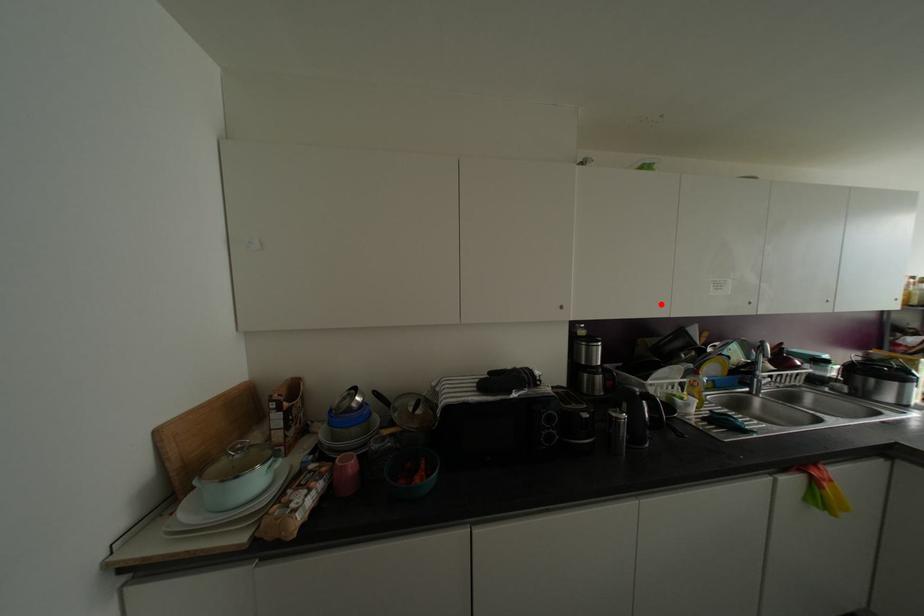
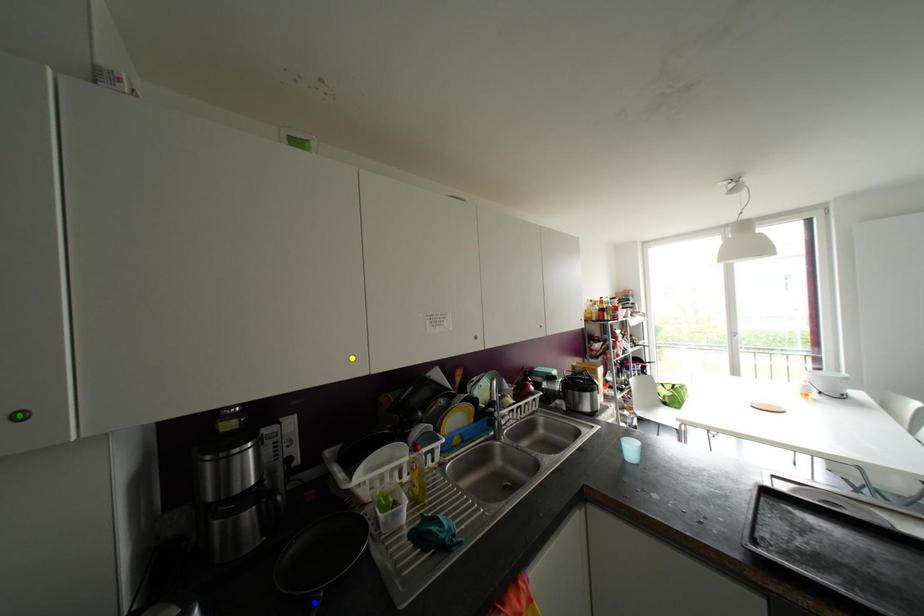
Question: I am providing you with two images of the same scene from different viewpoints. A red point is marked on the first image. You are given multiple points on the second image. Which point in image 2 represents the same 3d spot as the red point in image 1?

Choices:
 (A) yellow point
 (B) green point
 (C) blue point

Answer: (A)